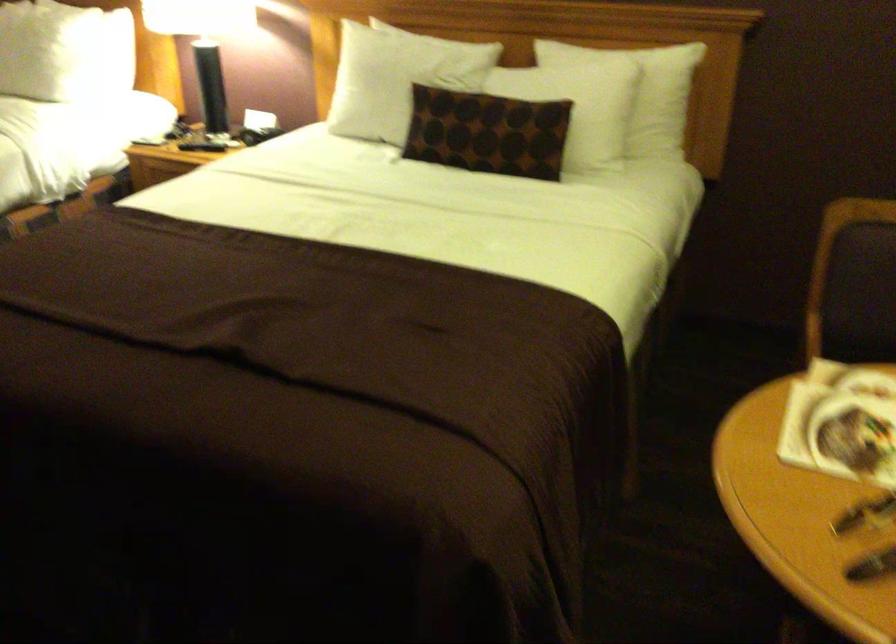
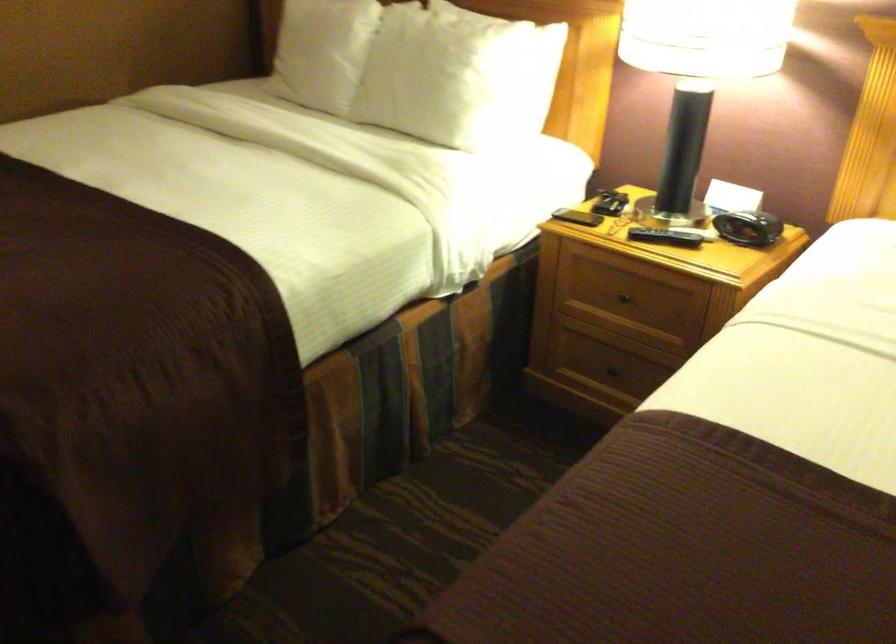
What movement of the cameraman would produce the second image?

The cameraman walked toward left, forward.